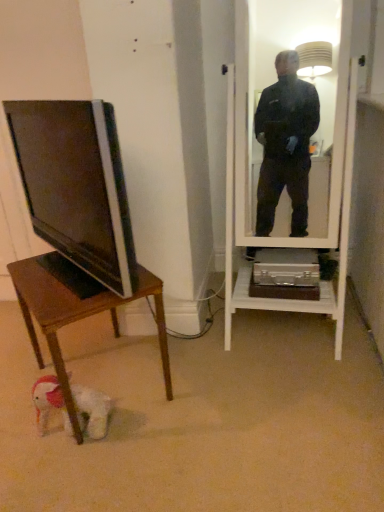
I want to click on vacant area that lies to the right of wooden desk at lower left, so click(x=207, y=391).